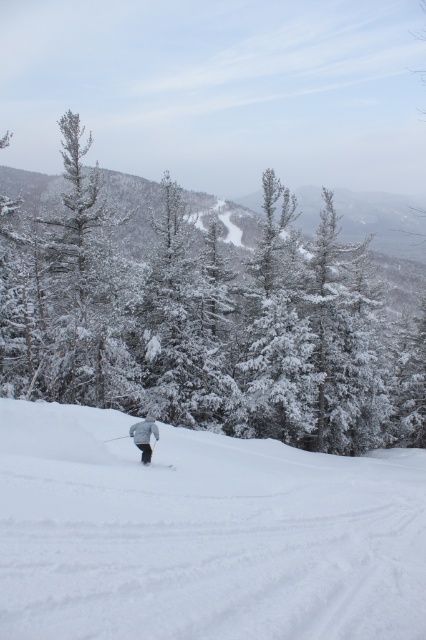
Question: Which object is positioned closest to the white snow ski slope at center?

Choices:
 (A) gray matte jacket at center
 (B) white matte ski at center

Answer: (B)

Question: Is white snow ski slope at center wider than white matte ski at center?

Choices:
 (A) no
 (B) yes

Answer: (B)

Question: Is snow-covered evergreen tree at center wider than white matte ski at center?

Choices:
 (A) no
 (B) yes

Answer: (B)

Question: Which point appears farthest from the camera in this image?

Choices:
 (A) (146, 448)
 (B) (42, 445)

Answer: (A)

Question: Which is nearer to the snow-covered evergreen tree at center?

Choices:
 (A) gray matte jacket at center
 (B) white matte ski at center

Answer: (A)

Question: Can you confirm if white snow ski slope at center is positioned above white matte ski at center?

Choices:
 (A) no
 (B) yes

Answer: (A)